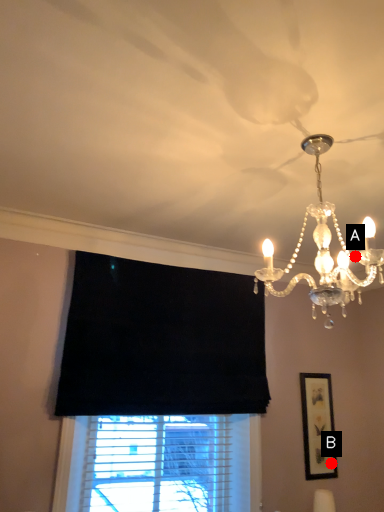
Question: Two points are circled on the image, labeled by A and B beside each circle. Which of the following is the closest to the observer?

Choices:
 (A) A is closer
 (B) B is closer

Answer: (A)